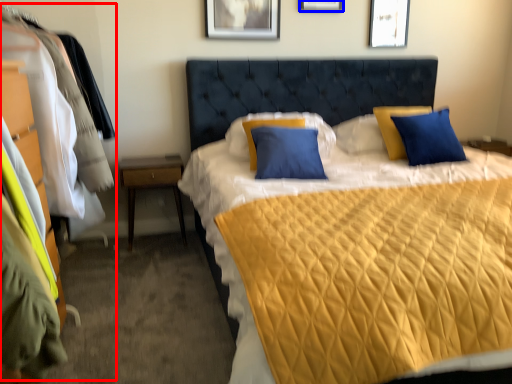
Question: Which of the following is the closest to the observer, dresser (highlighted by a red box) or picture frame (highlighted by a blue box)?

Choices:
 (A) dresser
 (B) picture frame

Answer: (A)